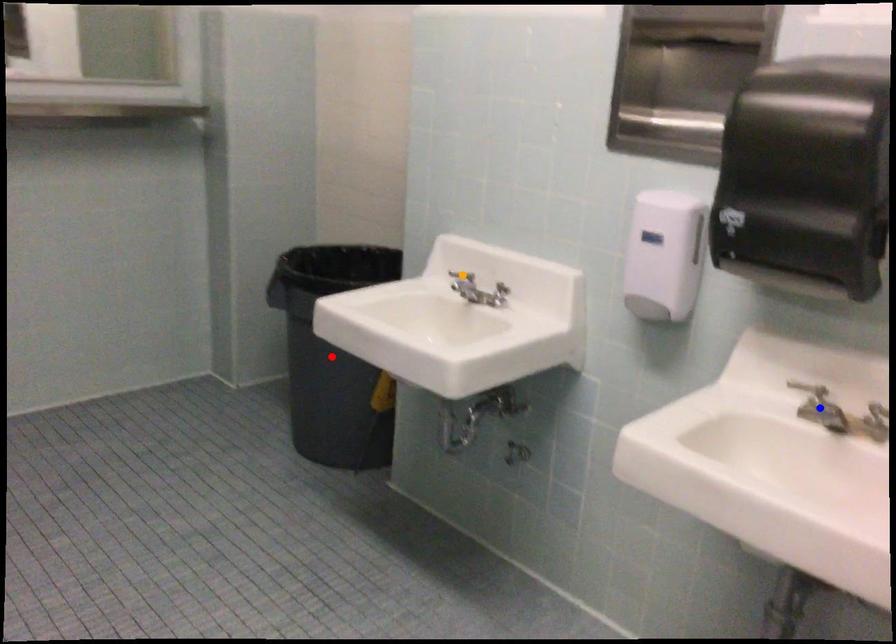
Order these from nearest to farthest:
red point, orange point, blue point

1. red point
2. orange point
3. blue point